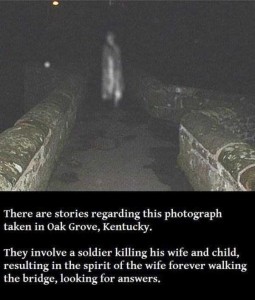
I want to click on empty space to left of wall, so click(x=19, y=99).